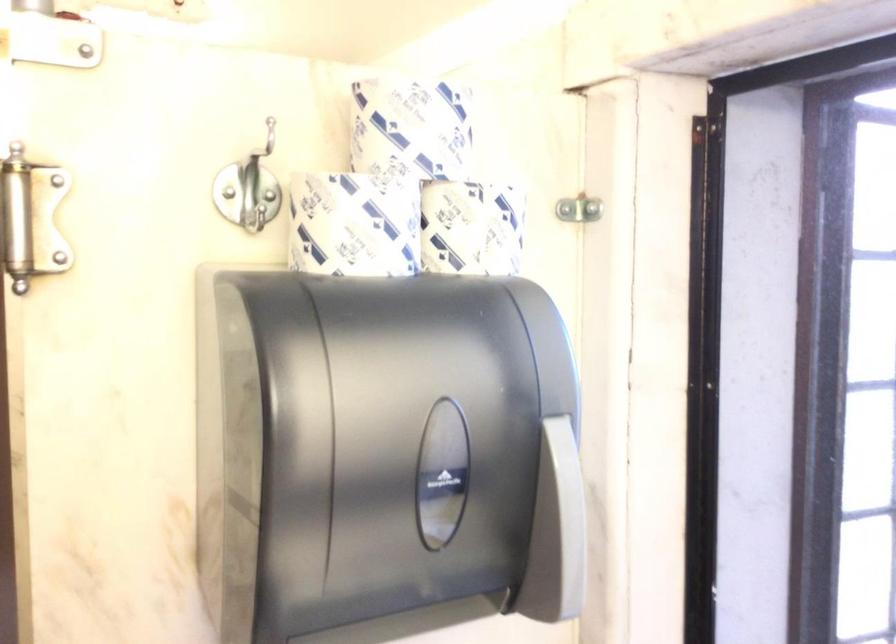
Question: The camera is either moving clockwise (left) or counter-clockwise (right) around the object. The first image is from the beginning of the video and the second image is from the end. Is the camera moving left or right when shooting the video?

Choices:
 (A) Left
 (B) Right

Answer: (A)